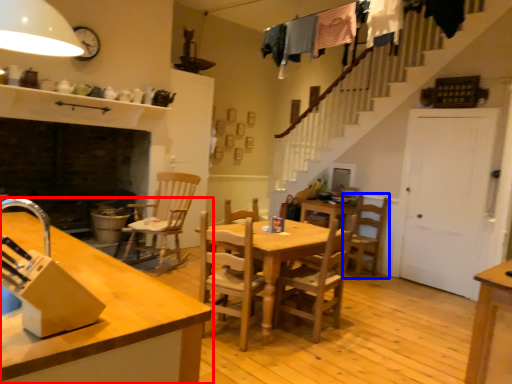
Question: Which object appears farthest to the camera in this image, countertop (highlighted by a red box) or chair (highlighted by a blue box)?

Choices:
 (A) countertop
 (B) chair

Answer: (B)